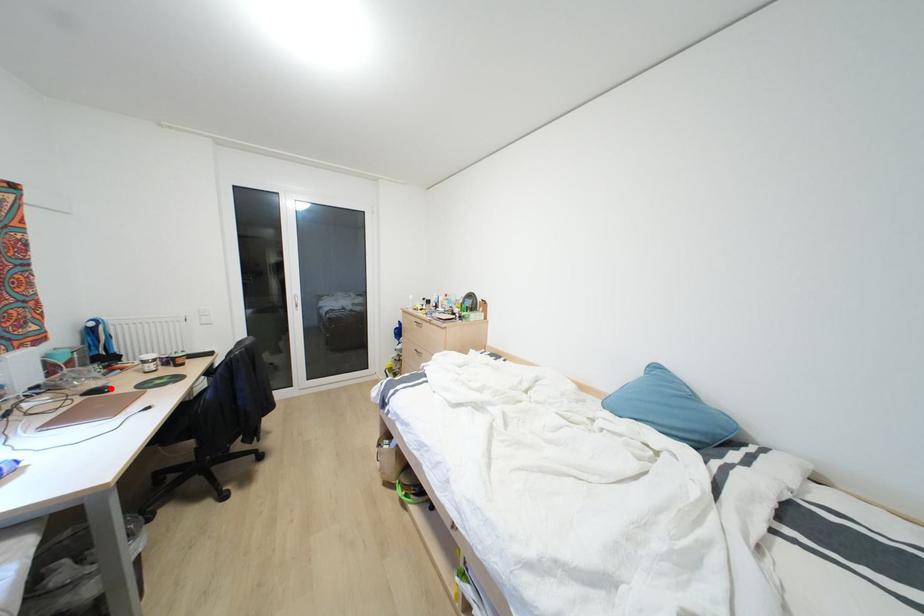
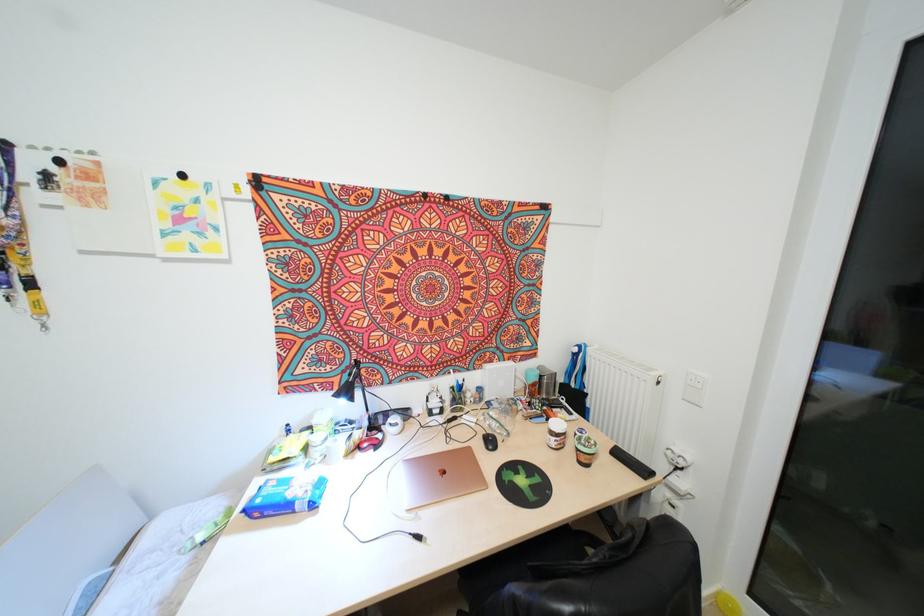
In the second image, find the point that corresponds to the highlighted location in the first image.

(494, 448)